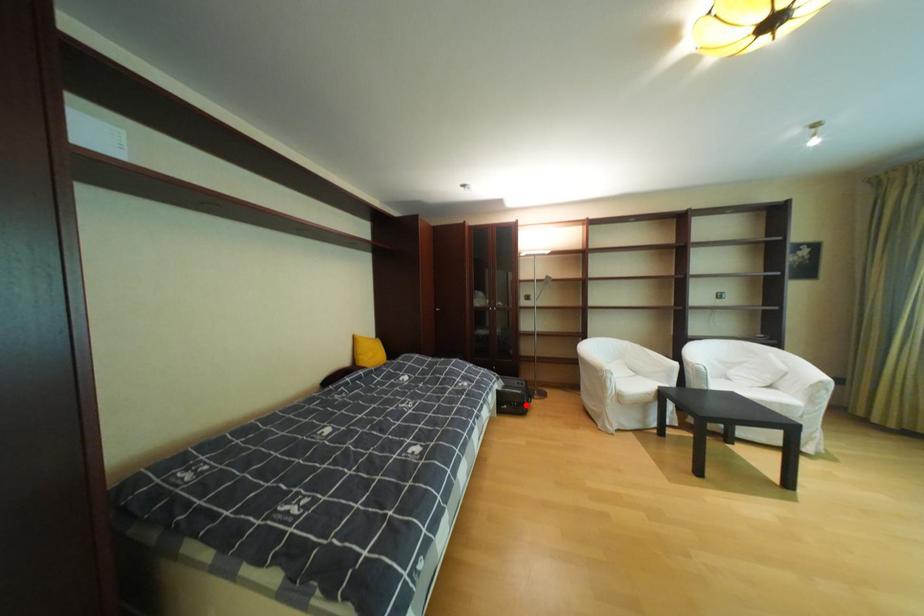
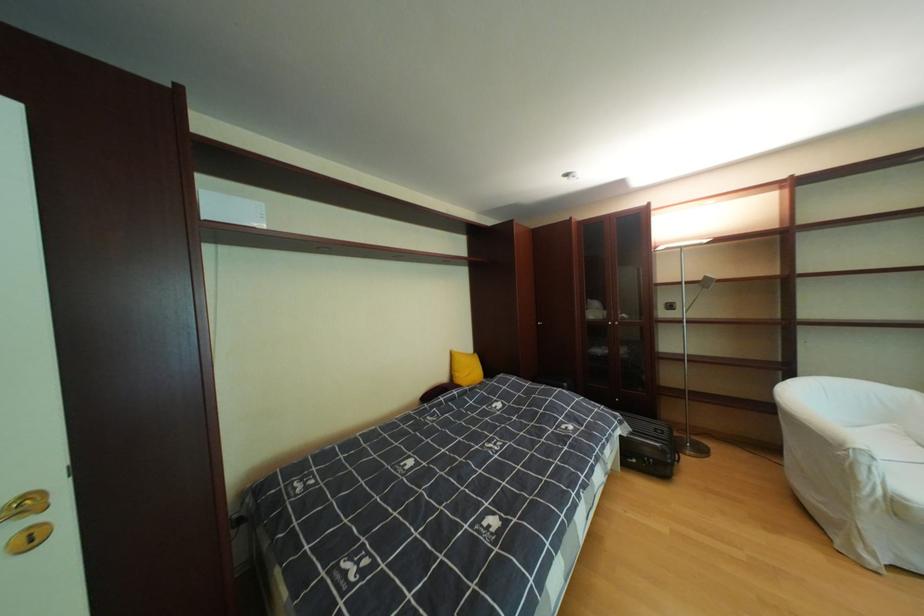
Question: I am providing you with two images of the same scene from different viewpoints. Given a red point in image1, look at the same physical point in image2. Is it:

Choices:
 (A) Closer to the viewpoint
 (B) Farther from the viewpoint

Answer: (A)